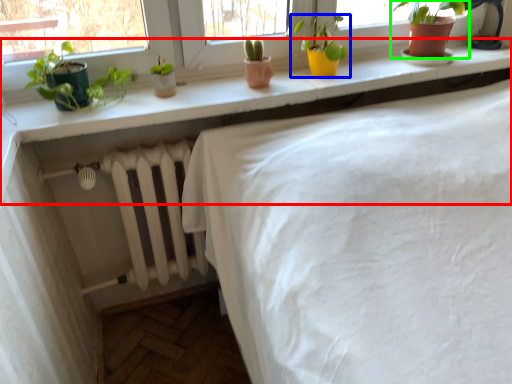
Question: Estimate the real-world distances between objects in this image. Which object is closer to counter (highlighted by a red box), houseplant (highlighted by a blue box) or houseplant (highlighted by a green box)?

Choices:
 (A) houseplant
 (B) houseplant

Answer: (A)